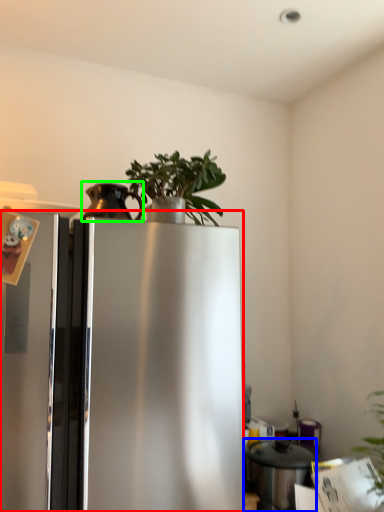
Question: Which object is positioned closest to refrigerator (highlighted by a red box)? Select from appliance (highlighted by a blue box) and appliance (highlighted by a green box).

Choices:
 (A) appliance
 (B) appliance

Answer: (B)